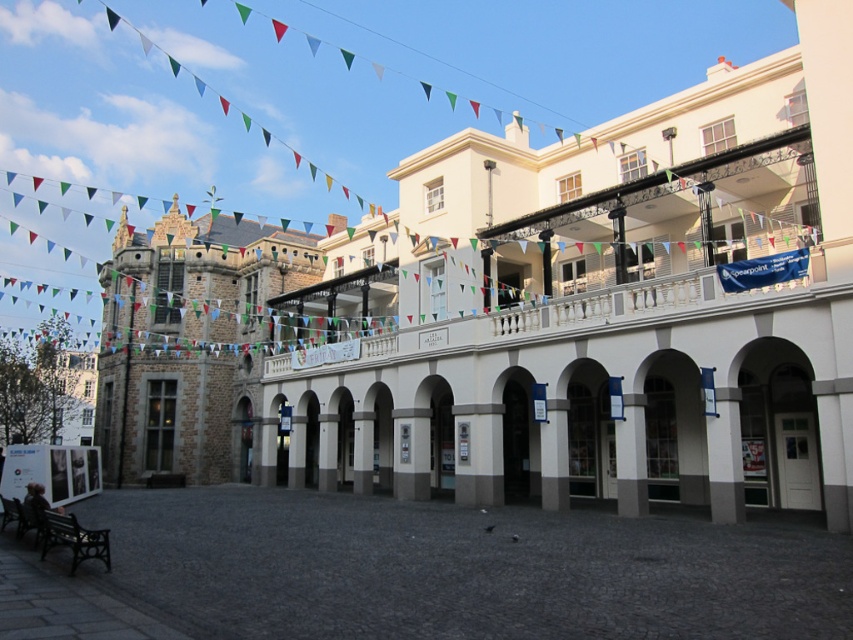
Question: From the image, what is the correct spatial relationship of dark gray cobblestone courtyard at center in relation to stone building at center?

Choices:
 (A) below
 (B) above

Answer: (A)

Question: Observing the image, what is the correct spatial positioning of stone building at center in reference to brown wooden bench at lower left?

Choices:
 (A) above
 (B) below

Answer: (A)

Question: Which of the following is the farthest from the observer?

Choices:
 (A) (228, 568)
 (B) (163, 284)

Answer: (B)

Question: Which point is farther from the camera taking this photo?

Choices:
 (A) (94, 545)
 (B) (248, 586)

Answer: (A)

Question: Which point is closer to the camera?

Choices:
 (A) brown wooden bench at lower left
 (B) stone building at center

Answer: (A)

Question: Is dark gray cobblestone courtyard at center above brown wooden bench at lower left?

Choices:
 (A) no
 (B) yes

Answer: (A)